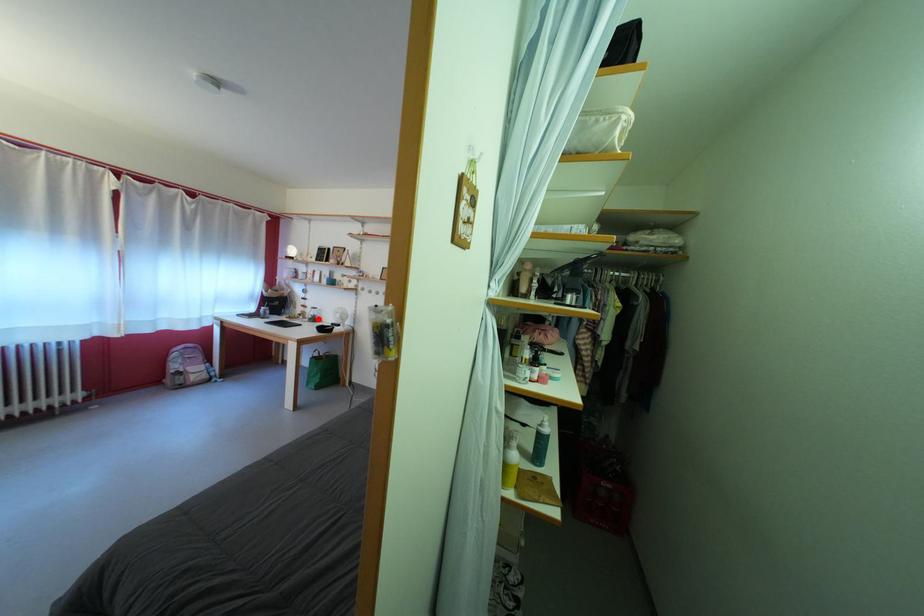
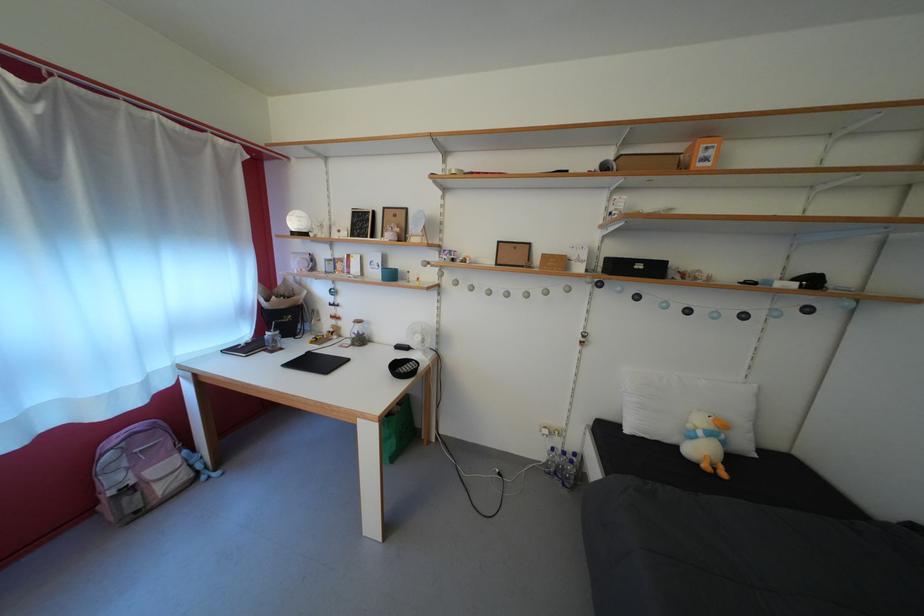
In the second image, find the point that corresponds to the highlighted location in the first image.

(358, 334)